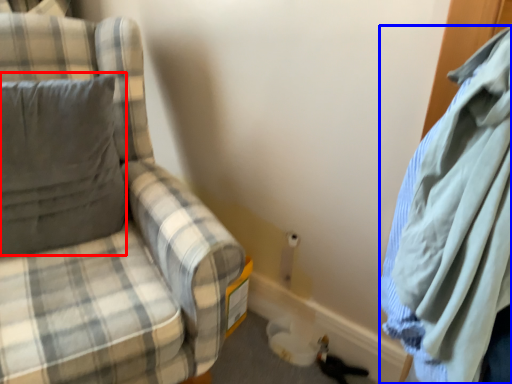
Question: Which of the following is the farthest to the observer, pillow (highlighted by a red box) or cloak (highlighted by a blue box)?

Choices:
 (A) pillow
 (B) cloak

Answer: (A)